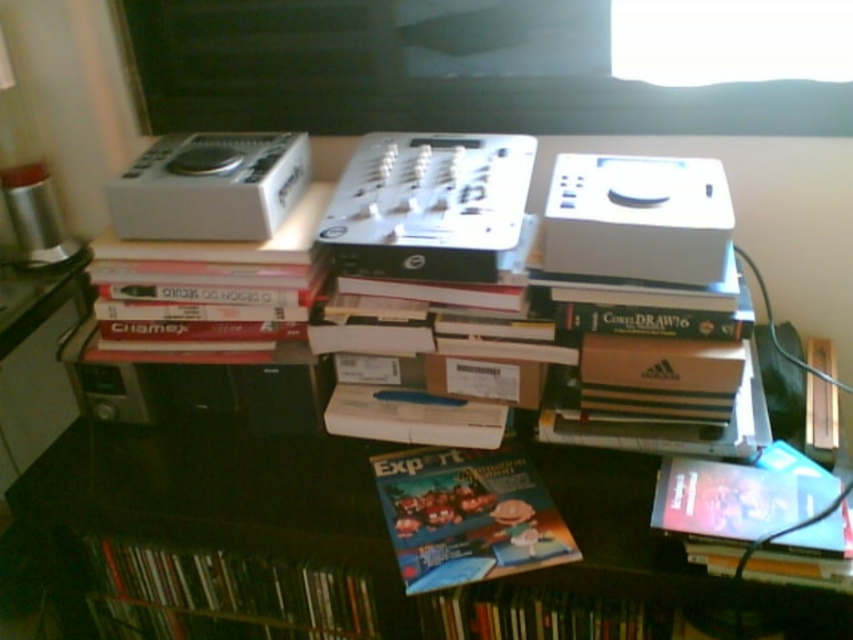
Based on the photo, you are a delivery person who needs to place a new package on the desk without moving any existing items. The package is 1 meter long. Is there enough space between the matte paper magazine at center and the edge of the desk to place it?

The distance between the matte paper magazine at center and the viewer is 97.65 centimeters. Since the package is 1 meter long, which is slightly longer than the available space, it won not fit without moving items.

You are organizing the items on the desk and need to place a new item between the matte paper magazine at center and the matte plastic book at lower left. Based on their positions, where should you place the new item?

The matte paper magazine at center is located above the matte plastic book at lower left, so you should place the new item between them either above the matte plastic book at lower left or below the matte paper magazine at center to maintain their vertical arrangement.

You are organizing items on a desk and need to place a new item between the matte plastic book at lower left and the matte plastic book at lower right. Can you do this?

The matte plastic book at lower left is below the matte plastic book at lower right, so there is no space between them horizontally. You cannot place an item between them.